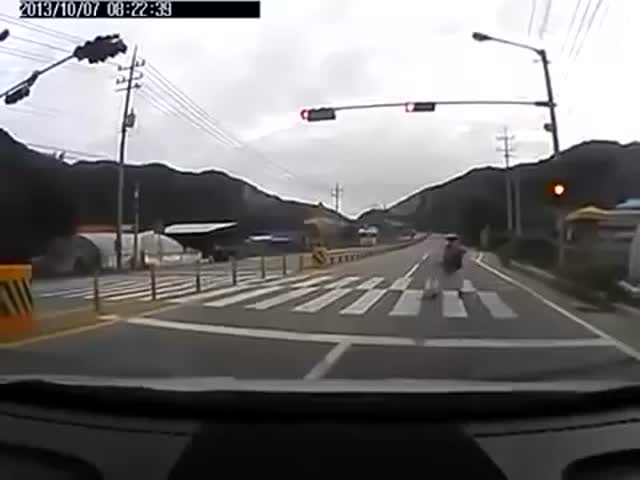
I want to click on door, so click(x=80, y=264).